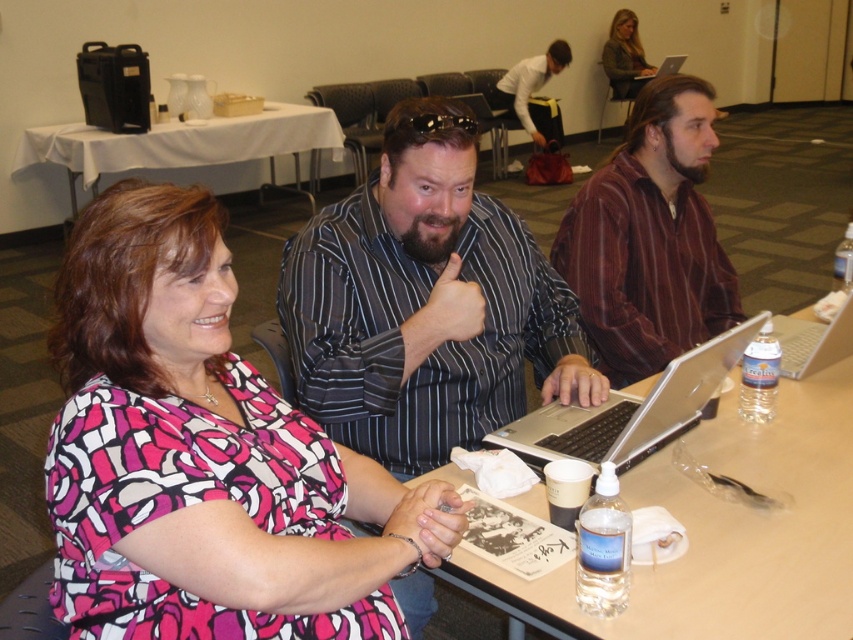
Is silver metallic laptop at center bigger than white cloth-covered table at upper left?

Incorrect, silver metallic laptop at center is not larger than white cloth-covered table at upper left.

Between silver metallic laptop at center and white cloth-covered table at upper left, which one has less height?

With less height is silver metallic laptop at center.

Which is in front, point (721, 365) or point (286, 109)?

Point (721, 365) is more forward.

Identify the location of silver metallic laptop at center. The image size is (853, 640). (630, 410).

Between pink printed blouse at center and silver metallic laptop at upper right, which one is positioned higher?

Positioned higher is silver metallic laptop at upper right.

Does pink printed blouse at center come in front of silver metallic laptop at upper right?

Yes.

Between point (241, 529) and point (666, 67), which one is positioned in front?

Positioned in front is point (241, 529).

Find the location of a particular element. pink printed blouse at center is located at coordinates (206, 456).

Does brown striped shirt at center have a lesser width compared to silver metallic laptop at center?

No.

Which of these two, brown striped shirt at center or silver metallic laptop at center, stands shorter?

With less height is silver metallic laptop at center.

Describe the element at coordinates (648, 237) in the screenshot. I see `brown striped shirt at center` at that location.

I want to click on brown striped shirt at center, so click(648, 237).